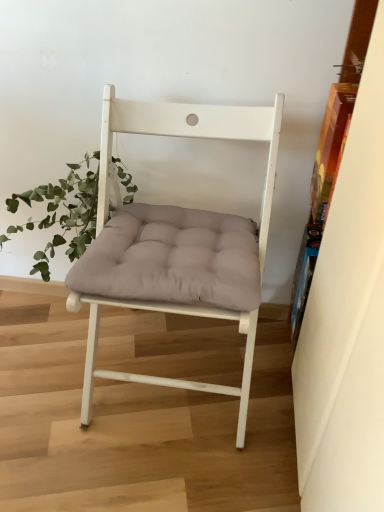
Question: Is wooden bookshelf at right behind matte white chair at center?

Choices:
 (A) no
 (B) yes

Answer: (A)

Question: Is matte white chair at center a part of wooden bookshelf at right?

Choices:
 (A) yes
 (B) no

Answer: (B)

Question: From a real-world perspective, does wooden bookshelf at right stand above matte white chair at center?

Choices:
 (A) no
 (B) yes

Answer: (B)

Question: Would you say wooden bookshelf at right is a long distance from matte white chair at center?

Choices:
 (A) no
 (B) yes

Answer: (A)

Question: Does wooden bookshelf at right have a smaller size compared to matte white chair at center?

Choices:
 (A) yes
 (B) no

Answer: (A)

Question: Is wooden bookshelf at right wider than matte white chair at center?

Choices:
 (A) no
 (B) yes

Answer: (A)

Question: Does green leafy plant at left have a lesser width compared to wooden bookshelf at right?

Choices:
 (A) yes
 (B) no

Answer: (B)

Question: Is green leafy plant at left bigger than wooden bookshelf at right?

Choices:
 (A) no
 (B) yes

Answer: (A)

Question: Are green leafy plant at left and wooden bookshelf at right beside each other?

Choices:
 (A) no
 (B) yes

Answer: (A)

Question: Are green leafy plant at left and wooden bookshelf at right located far from each other?

Choices:
 (A) yes
 (B) no

Answer: (B)

Question: Considering the relative sizes of green leafy plant at left and wooden bookshelf at right in the image provided, is green leafy plant at left wider than wooden bookshelf at right?

Choices:
 (A) no
 (B) yes

Answer: (B)

Question: Considering the relative sizes of green leafy plant at left and wooden bookshelf at right in the image provided, is green leafy plant at left smaller than wooden bookshelf at right?

Choices:
 (A) no
 (B) yes

Answer: (B)

Question: Can you confirm if matte white chair at center is smaller than wooden bookshelf at right?

Choices:
 (A) yes
 (B) no

Answer: (B)